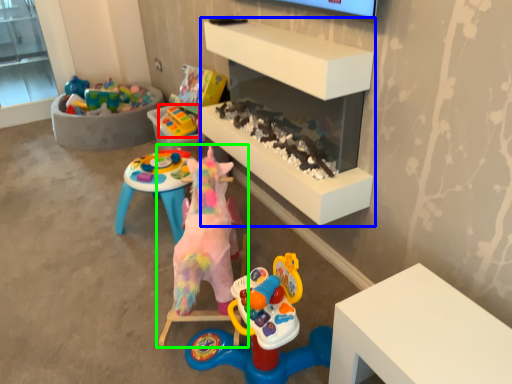
Question: Which object is the farthest from toy (highlighted by a red box)? Choose among these: shelf (highlighted by a blue box) or toy (highlighted by a green box).

Choices:
 (A) shelf
 (B) toy

Answer: (B)